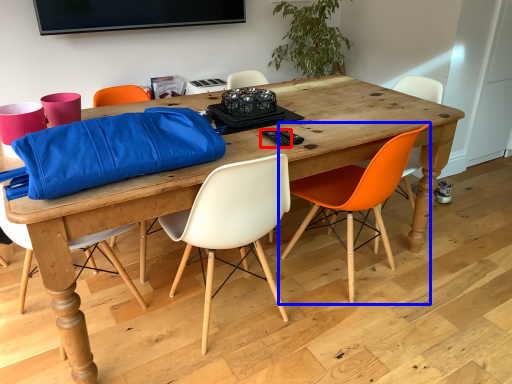
Question: Which object appears closest to the camera in this image, remote control (highlighted by a red box) or chair (highlighted by a blue box)?

Choices:
 (A) remote control
 (B) chair

Answer: (B)